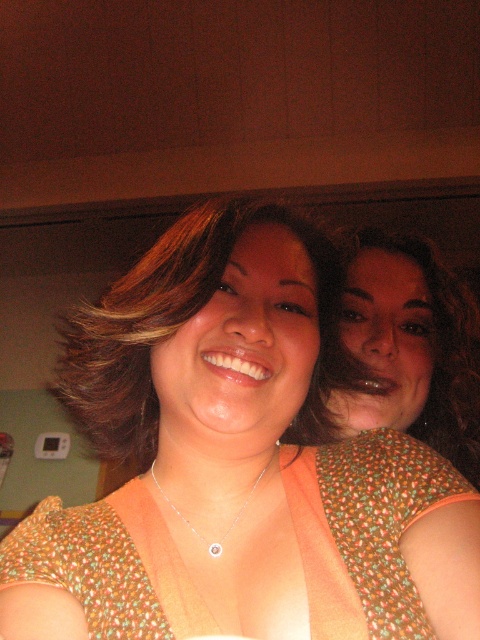
Based on the photo, does printed fabric dress at center appear under silver/gold chain with pendant at center?

Correct, printed fabric dress at center is located below silver/gold chain with pendant at center.

Is printed fabric dress at center taller than silver/gold chain with pendant at center?

Yes.

Between point (87, 605) and point (207, 544), which one is positioned in front?

Positioned in front is point (87, 605).

Image resolution: width=480 pixels, height=640 pixels. I want to click on printed fabric dress at center, so click(106, 563).

Is point (129, 492) in front of point (279, 211)?

No.

Which is behind, point (156, 600) or point (134, 266)?

The point (134, 266) is behind.

You are a GUI agent. You are given a task and a screenshot of the screen. Output one action in this format:
    pyautogui.click(x=<x>, y=<y>)
    Task: Click on the printed fabric dress at center
    
    Given the screenshot: What is the action you would take?
    pyautogui.click(x=106, y=563)

Which is in front, point (166, 307) or point (240, 518)?

Positioned in front is point (166, 307).

The image size is (480, 640). What do you see at coordinates (184, 323) in the screenshot? I see `matte brown hair at center` at bounding box center [184, 323].

Who is more distant from viewer, (299, 442) or (240, 515)?

Point (299, 442)

Identify the location of matte brown hair at center. (184, 323).